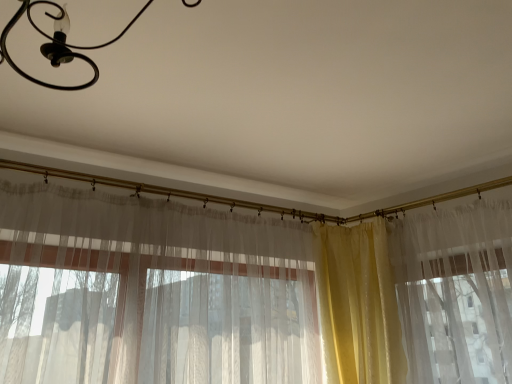
Question: Does black matte chandelier at upper left come in front of yellow satin curtain at right, which is the second curtain from left to right?

Choices:
 (A) no
 (B) yes

Answer: (B)

Question: Is black matte chandelier at upper left with yellow satin curtain at right, which is the second curtain from left to right?

Choices:
 (A) no
 (B) yes

Answer: (A)

Question: From a real-world perspective, is black matte chandelier at upper left over yellow satin curtain at right, which is the second curtain from left to right?

Choices:
 (A) no
 (B) yes

Answer: (B)

Question: Does black matte chandelier at upper left have a greater width compared to yellow satin curtain at right, which is the second curtain from left to right?

Choices:
 (A) no
 (B) yes

Answer: (B)

Question: Is black matte chandelier at upper left to the left of yellow satin curtain at right, which is the 1th curtain from right to left, from the viewer's perspective?

Choices:
 (A) yes
 (B) no

Answer: (A)

Question: Considering the relative positions of black matte chandelier at upper left and yellow satin curtain at right, which is the 1th curtain from right to left, in the image provided, is black matte chandelier at upper left to the right of yellow satin curtain at right, which is the 1th curtain from right to left, from the viewer's perspective?

Choices:
 (A) yes
 (B) no

Answer: (B)

Question: Can you confirm if yellow satin curtain at right, which is the 1th curtain from right to left, is shorter than black matte chandelier at upper left?

Choices:
 (A) no
 (B) yes

Answer: (A)

Question: Is yellow satin curtain at right, which is the second curtain from left to right, looking in the opposite direction of black matte chandelier at upper left?

Choices:
 (A) no
 (B) yes

Answer: (A)

Question: From the image's perspective, is yellow satin curtain at right, which is the 1th curtain from right to left, above black matte chandelier at upper left?

Choices:
 (A) no
 (B) yes

Answer: (A)

Question: Can you confirm if yellow satin curtain at right, which is the 1th curtain from right to left, is positioned to the left of black matte chandelier at upper left?

Choices:
 (A) no
 (B) yes

Answer: (A)

Question: Could you tell me if yellow satin curtain at right, which is the second curtain from left to right, is turned towards black matte chandelier at upper left?

Choices:
 (A) yes
 (B) no

Answer: (A)

Question: Can you confirm if yellow satin curtain at right, which is the 1th curtain from right to left, is positioned to the right of black matte chandelier at upper left?

Choices:
 (A) no
 (B) yes

Answer: (B)

Question: Does yellow satin curtain at right, which is the 1th curtain from right to left, lie in front of translucent fabric curtain at center, which is the 2th curtain in right-to-left order?

Choices:
 (A) yes
 (B) no

Answer: (B)